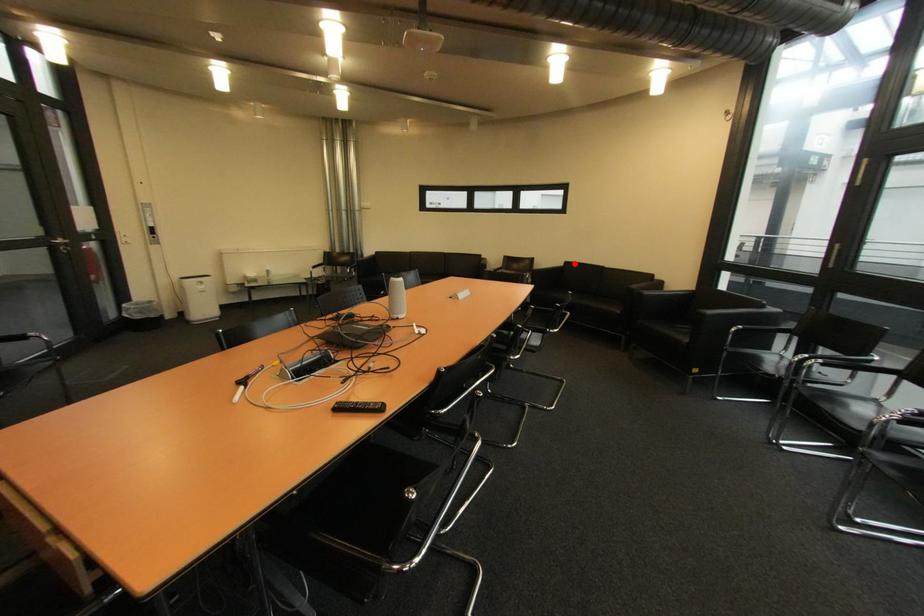
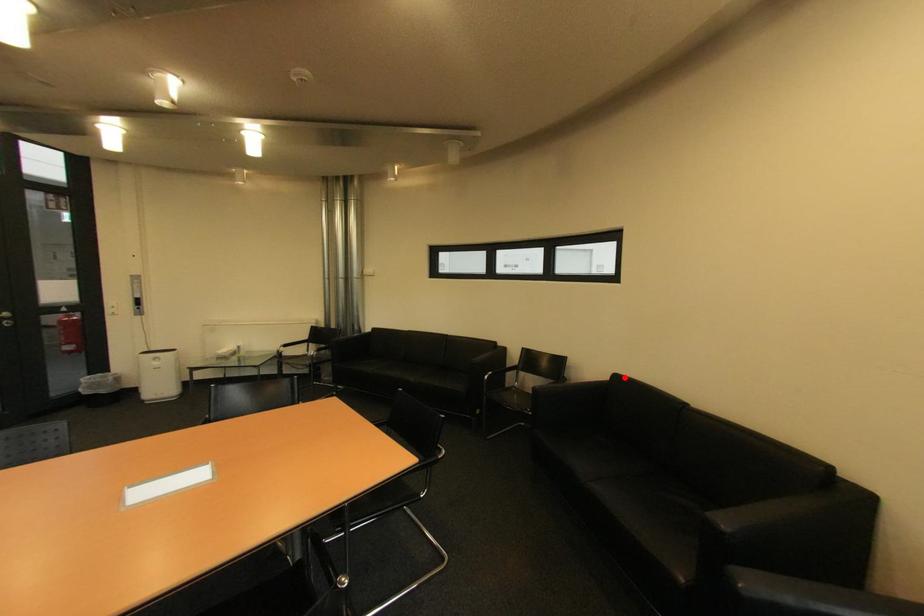
I am providing you with two images of the same scene from different viewpoints. A red point is marked on the first image and another point is marked on the second image. Does the point marked in image1 correspond to the same location as the one in image2?

Yes